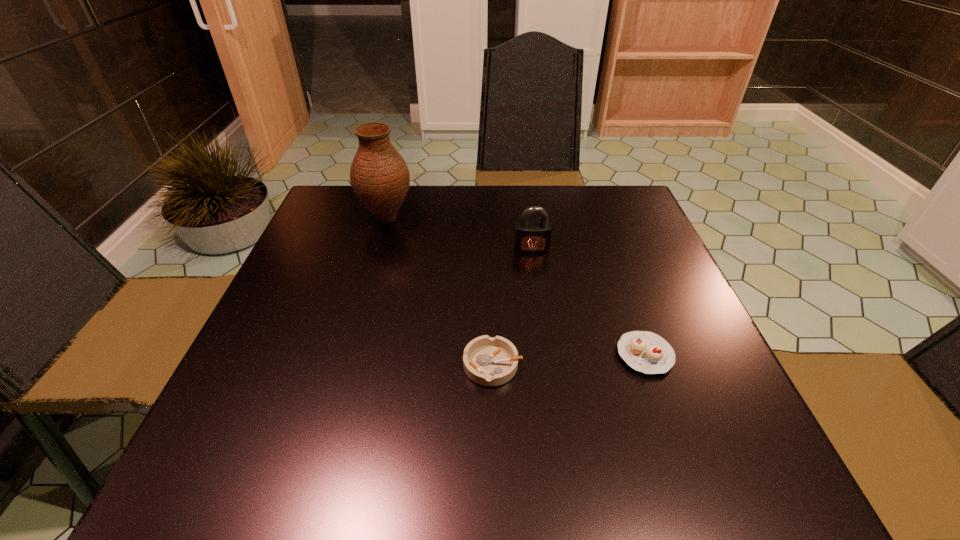
I want to click on the leftmost object, so click(379, 176).

Locate an element on the screen. the farthest object is located at coordinates (379, 176).

I want to click on the third nearest object, so click(531, 237).

Identify the location of the second tallest object. The height and width of the screenshot is (540, 960). (531, 237).

Locate an element on the screen. The height and width of the screenshot is (540, 960). the rightmost object is located at coordinates (644, 351).

This screenshot has height=540, width=960. Identify the location of cupcake. (644, 351).

Identify the location of the second object from left to right. (488, 361).

In order to click on ashtray in this screenshot , I will do `click(488, 361)`.

I want to click on free spot located on the back of the leftmost object, so click(396, 190).

I want to click on vacant space located on the front of the padlock near the keyhole, so click(549, 373).